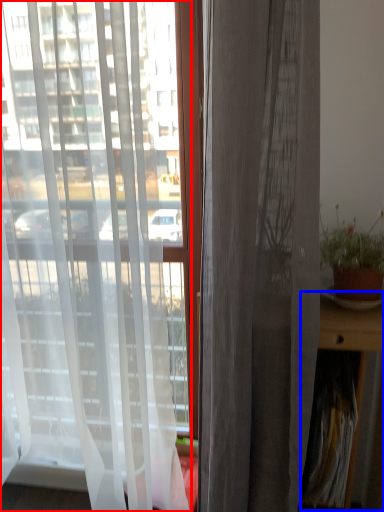
Question: Which object is further to the camera taking this photo, curtain (highlighted by a red box) or table (highlighted by a blue box)?

Choices:
 (A) curtain
 (B) table

Answer: (B)